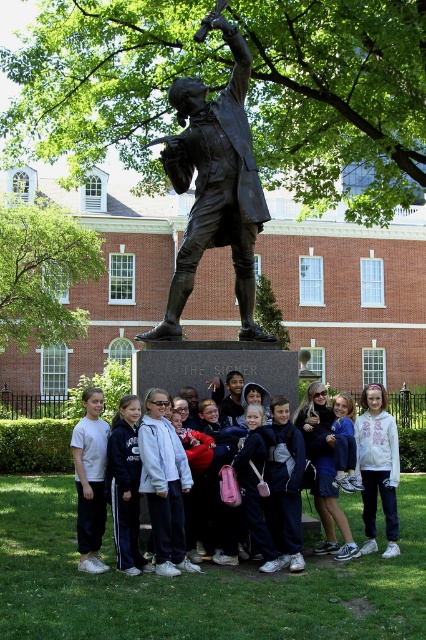
Question: Which of the following is the farthest from the observer?

Choices:
 (A) (348, 474)
 (B) (379, 406)
 (C) (187, 417)
 (D) (86, 506)

Answer: (B)

Question: Can you confirm if matte black jacket at center is thinner than white fleece hoodie at center?

Choices:
 (A) yes
 (B) no

Answer: (B)

Question: Which point is farther to the camera?

Choices:
 (A) white fleece hoodie at center
 (B) white cotton shirt at left
 (C) bronze statue at center
 (D) matte blue hoodie at center

Answer: (C)

Question: Which object is positioned farthest from the matte black jacket at center?

Choices:
 (A) white fleece hoodie at center
 (B) matte blue hoodie at center

Answer: (B)

Question: Does bronze statue at center have a smaller size compared to white cotton shirt at left?

Choices:
 (A) no
 (B) yes

Answer: (A)

Question: Is white fleece hoodie at center bigger than matte blue hoodie at center?

Choices:
 (A) no
 (B) yes

Answer: (B)